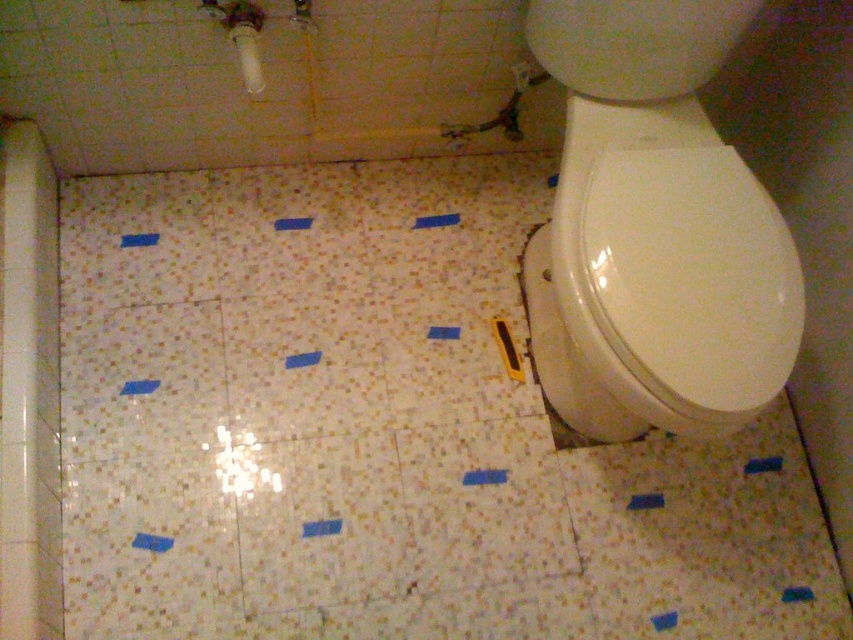
Question: Which point is farther to the camera?

Choices:
 (A) (244, 52)
 (B) (785, 337)
 (C) (766, 371)

Answer: (A)

Question: In this image, where is porcelain mosaic tile at center located relative to white glossy toilet lid at right?

Choices:
 (A) right
 (B) left

Answer: (B)

Question: Which of the following is the farthest from the observer?

Choices:
 (A) white matte toilet paper at upper left
 (B) porcelain mosaic tile at center

Answer: (B)

Question: Observing the image, what is the correct spatial positioning of white glossy toilet at right in reference to white matte toilet paper at upper left?

Choices:
 (A) left
 (B) right

Answer: (B)

Question: Among these objects, which one is farthest from the camera?

Choices:
 (A) white glossy toilet at right
 (B) porcelain mosaic tile at center
 (C) white glossy toilet lid at right

Answer: (B)

Question: Can you confirm if white glossy toilet at right is positioned above white matte toilet paper at upper left?

Choices:
 (A) yes
 (B) no

Answer: (B)